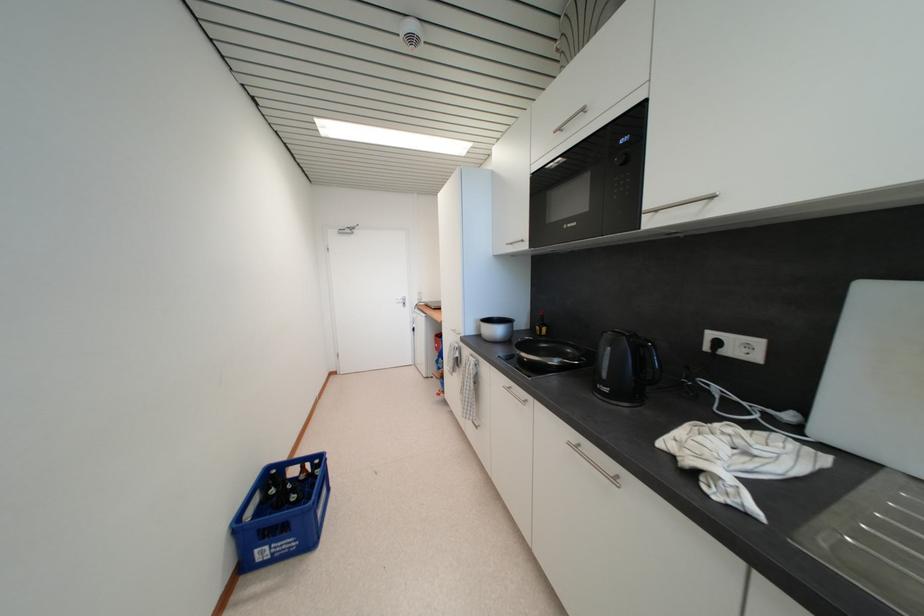
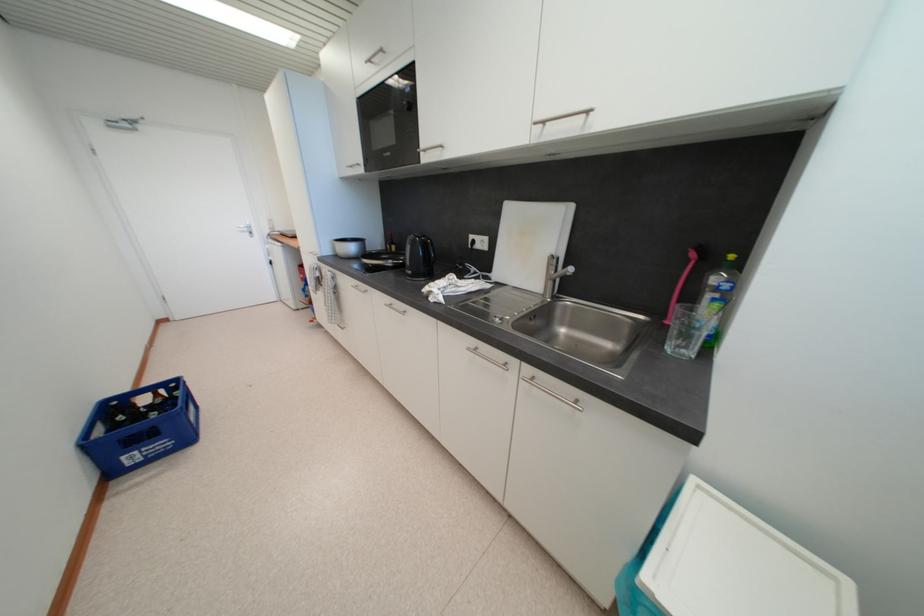
The point at (574, 446) is marked in the first image. Where is the corresponding point in the second image?

(391, 307)